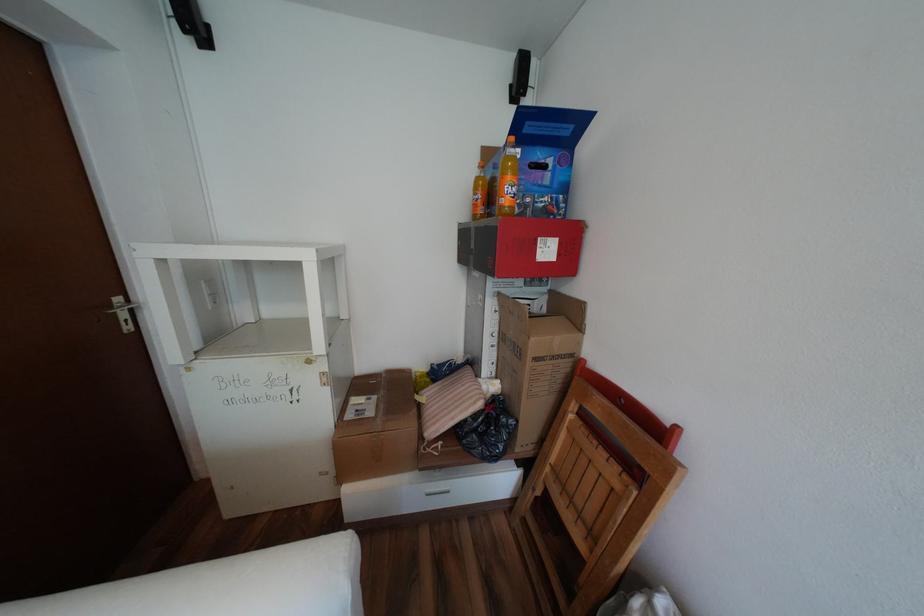
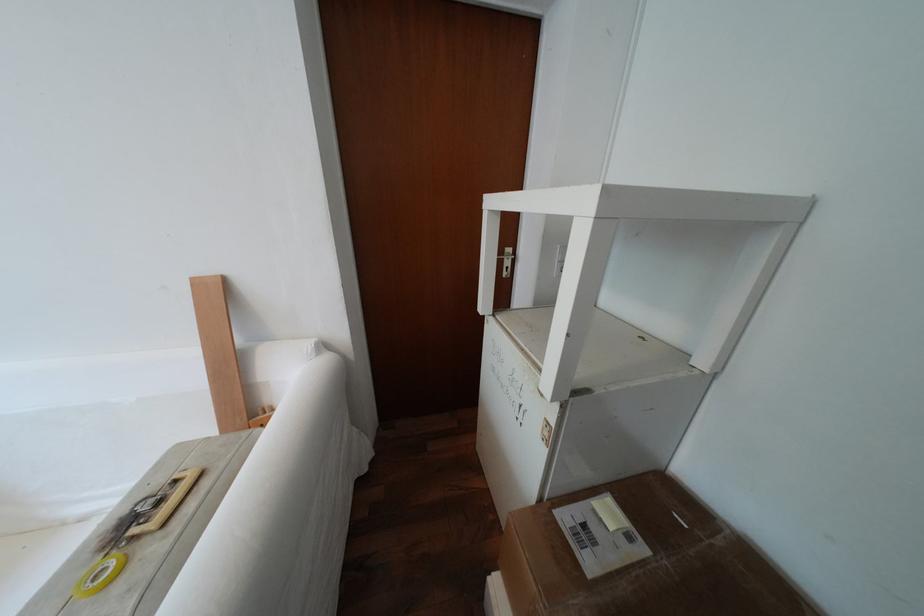
Based on the continuous images, in which direction is the camera rotating?

The camera rotated toward left-down.